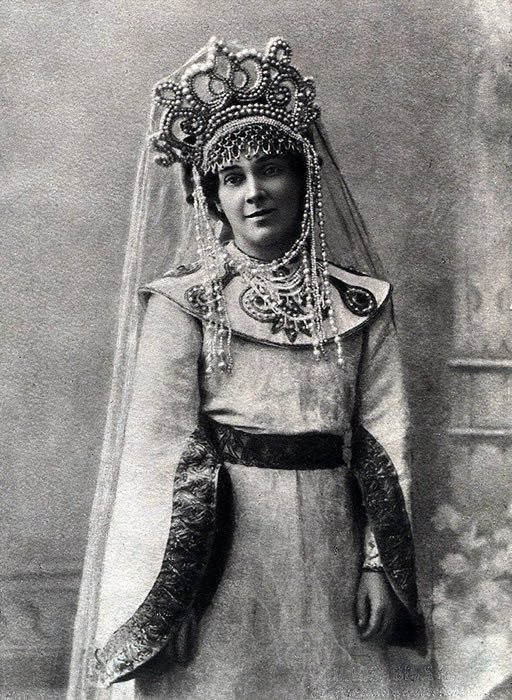
At what (x,y) coordinates should I click in order to perform the action: click on pillar. Please return your answer as a coordinate pair (x, y). Looking at the image, I should click on (475, 330).